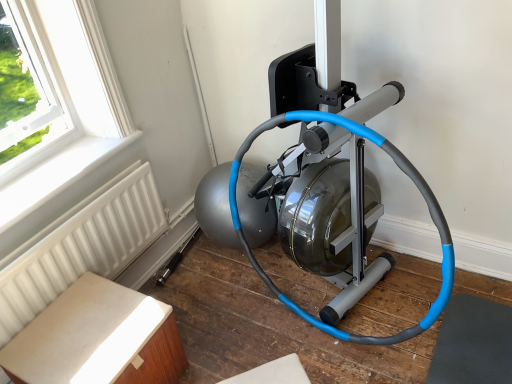
Question: Could you tell me if light brown wood table at lower left is turned towards white plastic radiator at lower left?

Choices:
 (A) yes
 (B) no

Answer: (B)

Question: From a real-world perspective, is light brown wood table at lower left below white plastic radiator at lower left?

Choices:
 (A) no
 (B) yes

Answer: (B)

Question: Considering the relative sizes of light brown wood table at lower left and white plastic radiator at lower left in the image provided, is light brown wood table at lower left taller than white plastic radiator at lower left?

Choices:
 (A) no
 (B) yes

Answer: (B)

Question: Would you say white plastic radiator at lower left is part of light brown wood table at lower left's contents?

Choices:
 (A) yes
 (B) no

Answer: (B)

Question: Can you confirm if light brown wood table at lower left is bigger than white plastic radiator at lower left?

Choices:
 (A) yes
 (B) no

Answer: (A)

Question: Does light brown wood table at lower left appear on the right side of white plastic radiator at lower left?

Choices:
 (A) yes
 (B) no

Answer: (A)

Question: Is blue rubber garden hose at center smaller than white textured radiator at lower left?

Choices:
 (A) yes
 (B) no

Answer: (B)

Question: From the image's perspective, is blue rubber garden hose at center on top of white textured radiator at lower left?

Choices:
 (A) yes
 (B) no

Answer: (A)

Question: Is white textured radiator at lower left at the back of blue rubber garden hose at center?

Choices:
 (A) no
 (B) yes

Answer: (A)

Question: Does blue rubber garden hose at center have a greater height compared to white textured radiator at lower left?

Choices:
 (A) no
 (B) yes

Answer: (B)

Question: From a real-world perspective, is blue rubber garden hose at center located beneath white textured radiator at lower left?

Choices:
 (A) yes
 (B) no

Answer: (B)

Question: Is blue rubber garden hose at center closer to camera compared to white textured radiator at lower left?

Choices:
 (A) no
 (B) yes

Answer: (B)

Question: From the image's perspective, is white plastic radiator at lower left over white textured radiator at lower left?

Choices:
 (A) yes
 (B) no

Answer: (A)